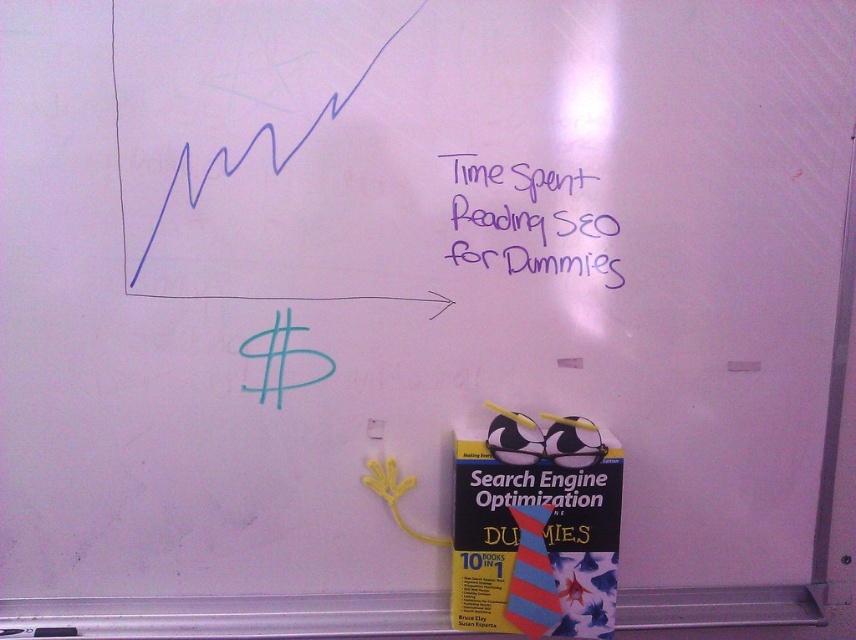
Question: Is purple marker writing at upper right closer to the viewer compared to yellow fabric tie at lower right?

Choices:
 (A) yes
 (B) no

Answer: (A)

Question: Observing the image, what is the correct spatial positioning of purple marker writing at upper right in reference to yellow fabric tie at lower right?

Choices:
 (A) above
 (B) below

Answer: (A)

Question: Among these points, which one is farthest from the camera?

Choices:
 (A) (556, 205)
 (B) (522, 570)

Answer: (A)

Question: Considering the relative positions of purple marker writing at upper right and yellow fabric tie at lower right in the image provided, where is purple marker writing at upper right located with respect to yellow fabric tie at lower right?

Choices:
 (A) below
 (B) above

Answer: (B)